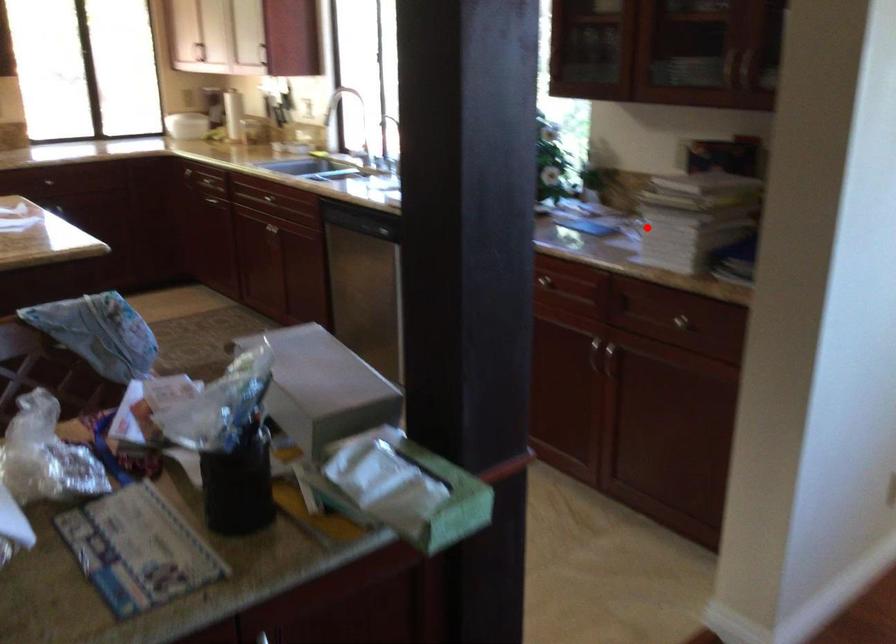
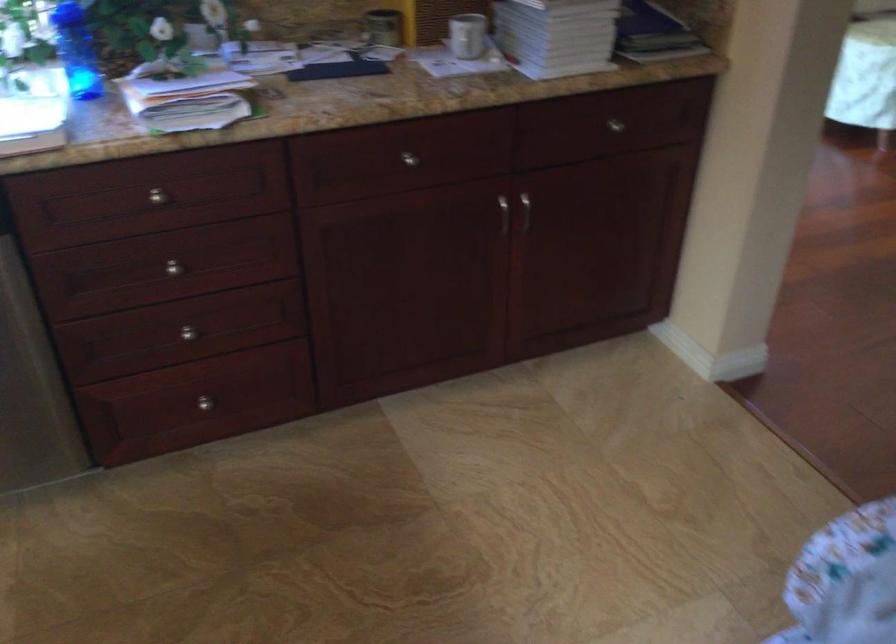
Find the pixel in the second image that matches the highlighted location in the first image.

(467, 35)